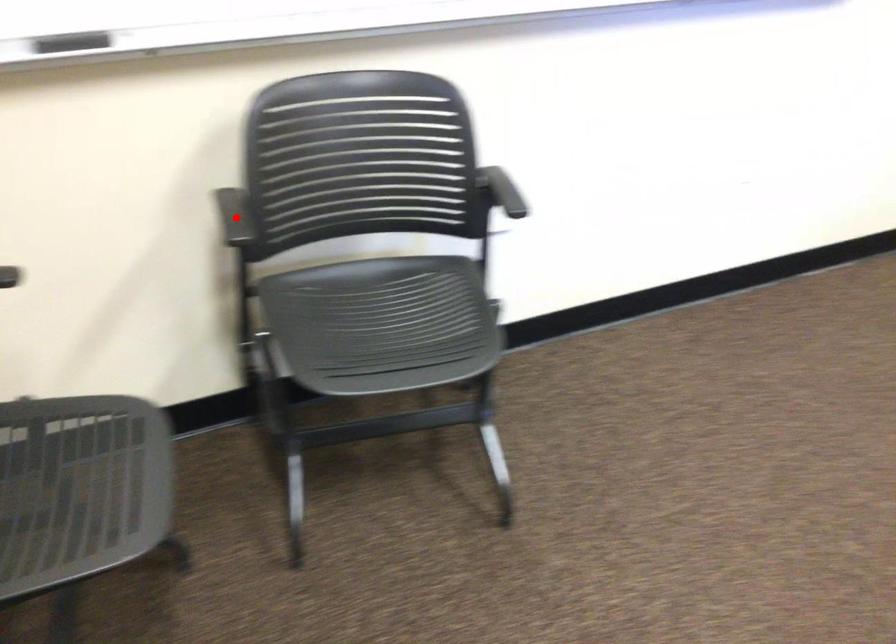
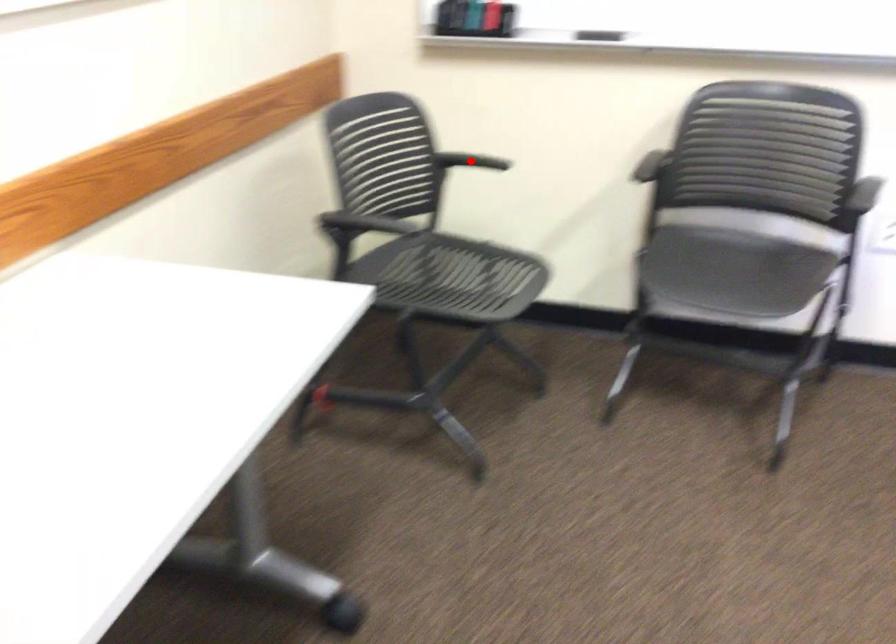
I am providing you with two images of the same scene from different viewpoints. A red point is marked on the first image and another point is marked on the second image. Is the marked point in image1 the same physical position as the marked point in image2?

No